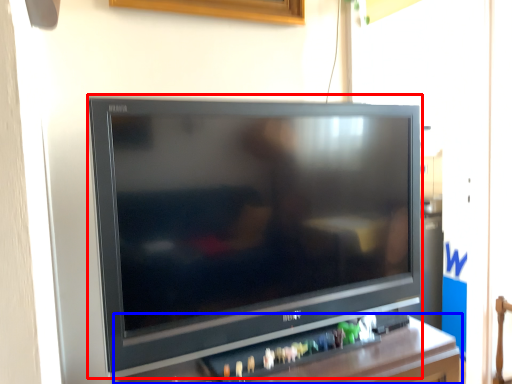
Question: Which point is further to the camera, television (highlighted by a red box) or furniture (highlighted by a blue box)?

Choices:
 (A) television
 (B) furniture

Answer: (A)